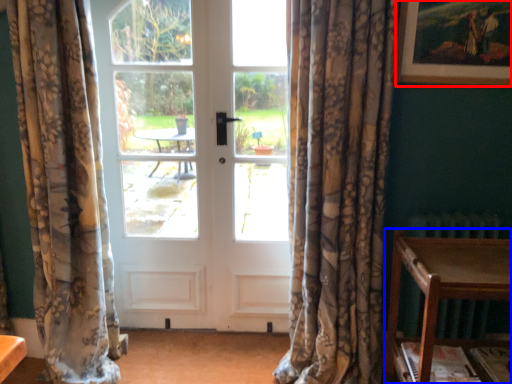
Question: Which point is further to the camera, picture frame (highlighted by a red box) or table (highlighted by a blue box)?

Choices:
 (A) picture frame
 (B) table

Answer: (A)